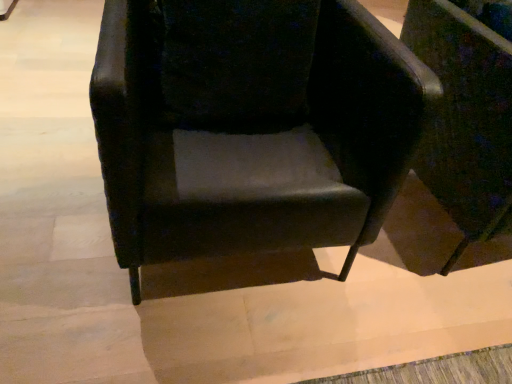
This screenshot has width=512, height=384. Describe the element at coordinates (467, 112) in the screenshot. I see `matte black chair at center, the 1th chair viewed from the right` at that location.

The height and width of the screenshot is (384, 512). I want to click on matte black chair at center, the 2th chair from the left, so click(x=467, y=112).

The width and height of the screenshot is (512, 384). What do you see at coordinates (251, 126) in the screenshot?
I see `velvet black armchair at center, which is counted as the second chair, starting from the right` at bounding box center [251, 126].

Where is `velvet black armchair at center, marked as the 1th chair in a left-to-right arrangement`? The height and width of the screenshot is (384, 512). velvet black armchair at center, marked as the 1th chair in a left-to-right arrangement is located at coordinates (251, 126).

Find the location of a particular element. This screenshot has width=512, height=384. matte black chair at center, the 2th chair from the left is located at coordinates (467, 112).

Which object is positioned more to the left, velvet black armchair at center, marked as the 1th chair in a left-to-right arrangement, or matte black chair at center, the 2th chair from the left?

velvet black armchair at center, marked as the 1th chair in a left-to-right arrangement, is more to the left.

Is velvet black armchair at center, marked as the 1th chair in a left-to-right arrangement, positioned in front of matte black chair at center, the 2th chair from the left?

Yes, it is.

Considering the points (202, 78) and (470, 212), which point is behind, point (202, 78) or point (470, 212)?

The point (470, 212) is behind.

From the image's perspective, relative to matte black chair at center, the 1th chair viewed from the right, is velvet black armchair at center, marked as the 1th chair in a left-to-right arrangement, above or below?

From the image's perspective, velvet black armchair at center, marked as the 1th chair in a left-to-right arrangement, appears below matte black chair at center, the 1th chair viewed from the right.

From a real-world perspective, who is located higher, velvet black armchair at center, marked as the 1th chair in a left-to-right arrangement, or matte black chair at center, the 2th chair from the left?

In real-world perspective, velvet black armchair at center, marked as the 1th chair in a left-to-right arrangement, is above.

Does velvet black armchair at center, which is counted as the second chair, starting from the right, have a greater width compared to matte black chair at center, the 2th chair from the left?

Indeed, velvet black armchair at center, which is counted as the second chair, starting from the right, has a greater width compared to matte black chair at center, the 2th chair from the left.

Considering the sizes of velvet black armchair at center, which is counted as the second chair, starting from the right, and matte black chair at center, the 1th chair viewed from the right, in the image, is velvet black armchair at center, which is counted as the second chair, starting from the right, taller or shorter than matte black chair at center, the 1th chair viewed from the right,?

Clearly, velvet black armchair at center, which is counted as the second chair, starting from the right, is shorter compared to matte black chair at center, the 1th chair viewed from the right.

Considering the sizes of objects velvet black armchair at center, marked as the 1th chair in a left-to-right arrangement, and matte black chair at center, the 1th chair viewed from the right, in the image provided, who is bigger, velvet black armchair at center, marked as the 1th chair in a left-to-right arrangement, or matte black chair at center, the 1th chair viewed from the right,?

velvet black armchair at center, marked as the 1th chair in a left-to-right arrangement, is bigger.

Would you say velvet black armchair at center, which is counted as the second chair, starting from the right, is inside or outside matte black chair at center, the 1th chair viewed from the right?

The correct answer is: outside.

Is velvet black armchair at center, marked as the 1th chair in a left-to-right arrangement, touching matte black chair at center, the 1th chair viewed from the right?

No, velvet black armchair at center, marked as the 1th chair in a left-to-right arrangement, is not beside matte black chair at center, the 1th chair viewed from the right.

Is velvet black armchair at center, marked as the 1th chair in a left-to-right arrangement, facing away from matte black chair at center, the 2th chair from the left?

No, velvet black armchair at center, marked as the 1th chair in a left-to-right arrangement,'s orientation is not away from matte black chair at center, the 2th chair from the left.

Can you tell me how much velvet black armchair at center, marked as the 1th chair in a left-to-right arrangement, and matte black chair at center, the 1th chair viewed from the right, differ in facing direction?

→ 0.00109 degrees separate the facing orientations of velvet black armchair at center, marked as the 1th chair in a left-to-right arrangement, and matte black chair at center, the 1th chair viewed from the right.

How distant is velvet black armchair at center, which is counted as the second chair, starting from the right, from matte black chair at center, the 2th chair from the left?

velvet black armchair at center, which is counted as the second chair, starting from the right, is 49.86 centimeters from matte black chair at center, the 2th chair from the left.

What are the coordinates of `chair on the left of matte black chair at center, the 1th chair viewed from the right` in the screenshot? It's located at (251, 126).

Would you say matte black chair at center, the 1th chair viewed from the right, is to the left or to the right of velvet black armchair at center, which is counted as the second chair, starting from the right, in the picture?

matte black chair at center, the 1th chair viewed from the right, is positioned on velvet black armchair at center, which is counted as the second chair, starting from the right,'s right side.

Does matte black chair at center, the 2th chair from the left, lie in front of velvet black armchair at center, which is counted as the second chair, starting from the right?

No, it is behind velvet black armchair at center, which is counted as the second chair, starting from the right.

Considering the points (464, 165) and (303, 57), which point is behind, point (464, 165) or point (303, 57)?

Point (464, 165)

From the image's perspective, which object appears higher, matte black chair at center, the 2th chair from the left, or velvet black armchair at center, marked as the 1th chair in a left-to-right arrangement?

matte black chair at center, the 2th chair from the left, from the image's perspective.

From a real-world perspective, does matte black chair at center, the 1th chair viewed from the right, sit lower than velvet black armchair at center, which is counted as the second chair, starting from the right?

Yes, from a real-world perspective, matte black chair at center, the 1th chair viewed from the right, is beneath velvet black armchair at center, which is counted as the second chair, starting from the right.

Is matte black chair at center, the 1th chair viewed from the right, wider than velvet black armchair at center, marked as the 1th chair in a left-to-right arrangement?

No.

Can you confirm if matte black chair at center, the 1th chair viewed from the right, is shorter than velvet black armchair at center, which is counted as the second chair, starting from the right?

In fact, matte black chair at center, the 1th chair viewed from the right, may be taller than velvet black armchair at center, which is counted as the second chair, starting from the right.

Considering the sizes of objects matte black chair at center, the 1th chair viewed from the right, and velvet black armchair at center, marked as the 1th chair in a left-to-right arrangement, in the image provided, who is smaller, matte black chair at center, the 1th chair viewed from the right, or velvet black armchair at center, marked as the 1th chair in a left-to-right arrangement,?

matte black chair at center, the 1th chair viewed from the right, is smaller.

Which is correct: matte black chair at center, the 1th chair viewed from the right, is inside velvet black armchair at center, which is counted as the second chair, starting from the right, or outside of it?

matte black chair at center, the 1th chair viewed from the right, cannot be found inside velvet black armchair at center, which is counted as the second chair, starting from the right.

Can you see matte black chair at center, the 1th chair viewed from the right, touching velvet black armchair at center, marked as the 1th chair in a left-to-right arrangement?

There is a gap between matte black chair at center, the 1th chair viewed from the right, and velvet black armchair at center, marked as the 1th chair in a left-to-right arrangement.

Could you tell me if matte black chair at center, the 2th chair from the left, is turned towards velvet black armchair at center, which is counted as the second chair, starting from the right?

No, matte black chair at center, the 2th chair from the left, is not oriented towards velvet black armchair at center, which is counted as the second chair, starting from the right.

Find the location of `chair that is above the velvet black armchair at center, which is counted as the second chair, starting from the right (from the image's perspective)`. chair that is above the velvet black armchair at center, which is counted as the second chair, starting from the right (from the image's perspective) is located at coordinates (467, 112).

The width and height of the screenshot is (512, 384). Identify the location of chair on the right of velvet black armchair at center, marked as the 1th chair in a left-to-right arrangement. (467, 112).

Identify the location of chair below the matte black chair at center, the 1th chair viewed from the right (from the image's perspective). (251, 126).